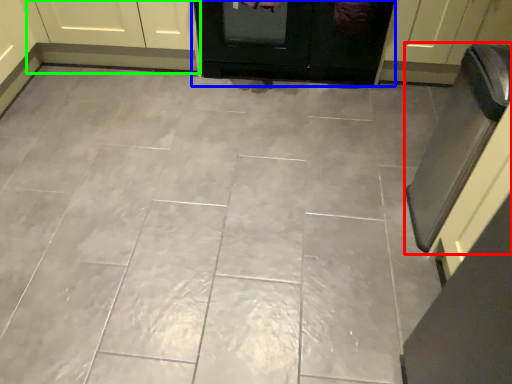
Question: Which object is positioned closest to oven (highlighted by a red box)? Select from door (highlighted by a blue box) and cabinetry (highlighted by a green box).

Choices:
 (A) door
 (B) cabinetry

Answer: (A)